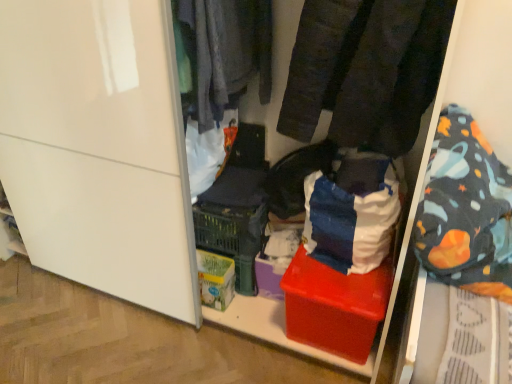
Question: Would you say red plastic storage bin at center is to the left or to the right of velvet-like black pants at center, the 1th clothing viewed from the right, in the picture?

Choices:
 (A) left
 (B) right

Answer: (A)

Question: Is point (249, 122) positioned closer to the camera than point (292, 64)?

Choices:
 (A) farther
 (B) closer

Answer: (A)

Question: Which of these objects is positioned farthest from the velvet-like black pants at center, the 1th clothing viewed from the right?

Choices:
 (A) dark gray fabric at upper center, which appears as the 2th clothing when viewed from the right
 (B) red plastic box at center
 (C) red plastic storage bin at center
 (D) green cardboard box at center

Answer: (D)

Question: Estimate the real-world distances between objects in this image. Which object is farther from the red plastic storage bin at center?

Choices:
 (A) velvet-like black pants at center, the second clothing when ordered from left to right
 (B) dark gray fabric at upper center, which appears as the 2th clothing when viewed from the right
 (C) green cardboard box at center
 (D) red plastic box at center

Answer: (D)